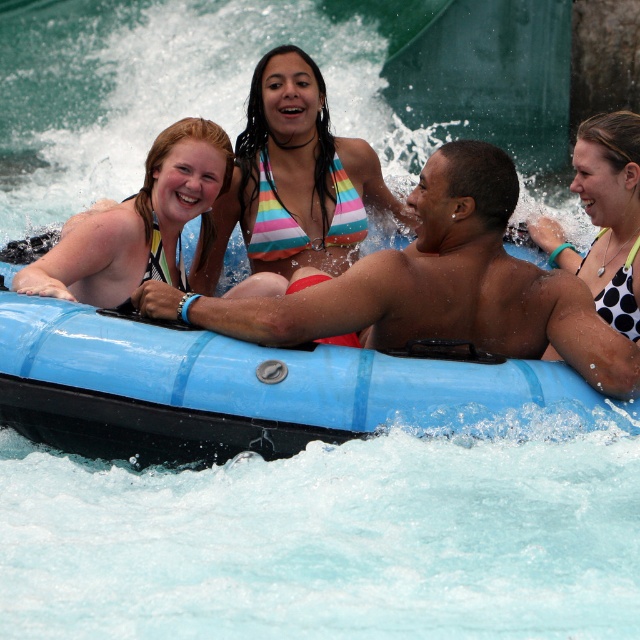
Question: Estimate the real-world distances between objects in this image. Which object is closer to the white dotted swimsuit at right?

Choices:
 (A) rainbow striped bikini top at center
 (B) matte black swimsuit at left
 (C) blue rubber raft at center

Answer: (C)

Question: Is matte black swimsuit at left above white dotted swimsuit at right?

Choices:
 (A) yes
 (B) no

Answer: (A)

Question: Estimate the real-world distances between objects in this image. Which object is farther from the rainbow striped bikini top at center?

Choices:
 (A) white dotted swimsuit at right
 (B) blue rubber raft at center

Answer: (B)

Question: Can you confirm if rainbow striped bikini top at center is bigger than matte black swimsuit at left?

Choices:
 (A) no
 (B) yes

Answer: (A)

Question: Which object is closer to the camera taking this photo?

Choices:
 (A) rainbow striped bikini top at center
 (B) white dotted swimsuit at right

Answer: (B)

Question: Is blue rubber raft at center to the left of white dotted swimsuit at right from the viewer's perspective?

Choices:
 (A) yes
 (B) no

Answer: (A)